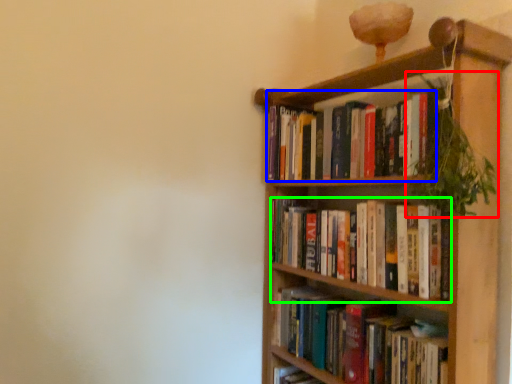
Question: Considering the real-world distances, which object is closest to vegetation (highlighted by a red box)? book (highlighted by a blue box) or book (highlighted by a green box).

Choices:
 (A) book
 (B) book

Answer: (A)